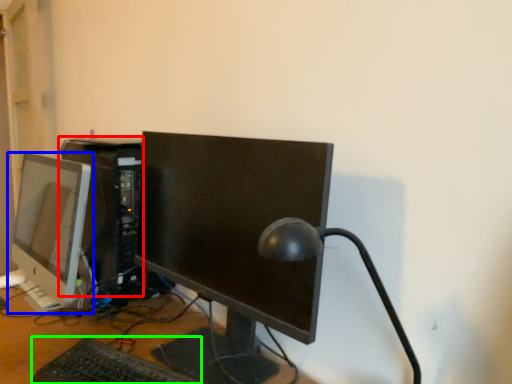
Question: Based on their relative distances, which object is nearer to computer tower (highlighted by a red box)? Choose from computer monitor (highlighted by a blue box) and computer keyboard (highlighted by a green box).

Choices:
 (A) computer monitor
 (B) computer keyboard

Answer: (B)